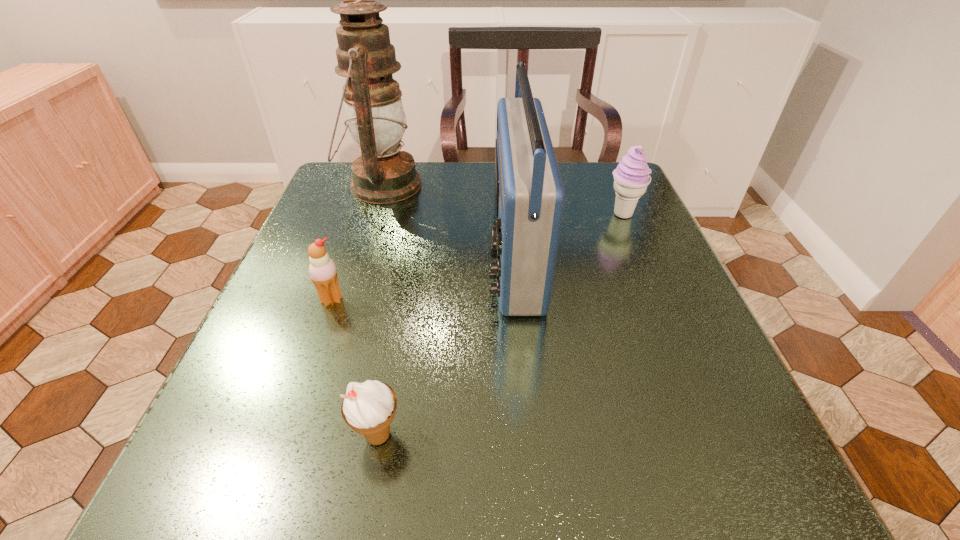
The width and height of the screenshot is (960, 540). What are the coordinates of `the tallest object` in the screenshot? It's located at (383, 174).

Where is `the fourth object from left to right`? The height and width of the screenshot is (540, 960). the fourth object from left to right is located at coordinates (529, 196).

You are a GUI agent. You are given a task and a screenshot of the screen. Output one action in this format:
    pyautogui.click(x=<x>, y=<y>)
    Task: Click on the radio receiver
    The height and width of the screenshot is (540, 960).
    Given the screenshot: What is the action you would take?
    pyautogui.click(x=529, y=196)

Find the location of `the rightmost object`. the rightmost object is located at coordinates (631, 177).

Find the location of a particular element. This screenshot has width=960, height=540. the farthest icecream is located at coordinates click(x=631, y=177).

Where is `the leftmost icecream`? the leftmost icecream is located at coordinates (323, 273).

This screenshot has width=960, height=540. I want to click on the nearest icecream, so click(x=368, y=408).

Identify the location of the second icecream from left to right. [368, 408].

Where is `vacant area situated on the front of the lantern`? Image resolution: width=960 pixels, height=540 pixels. vacant area situated on the front of the lantern is located at coordinates (336, 332).

The image size is (960, 540). I want to click on free space located on the front panel of the radio receiver, so click(x=438, y=254).